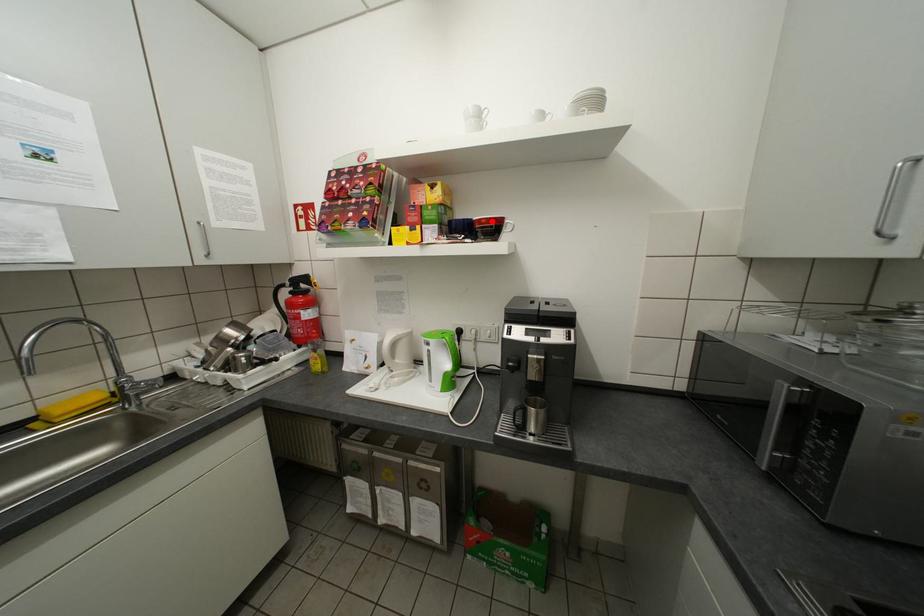
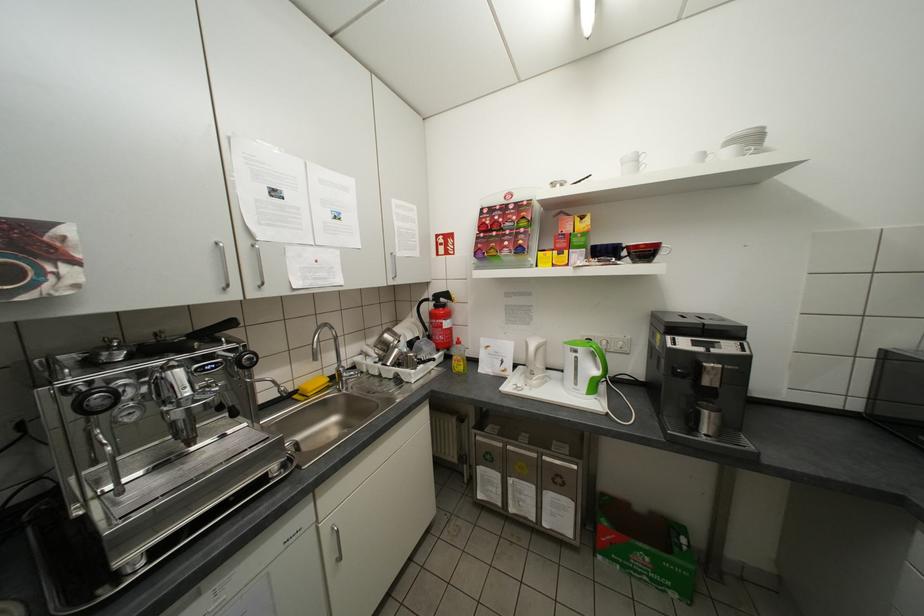
Question: I am providing you with two images of the same scene from different viewpoints. A red point is marked on the first image. At the location where the point appears in image 1, is it still visible in image 2?

Choices:
 (A) Yes
 (B) No

Answer: (A)